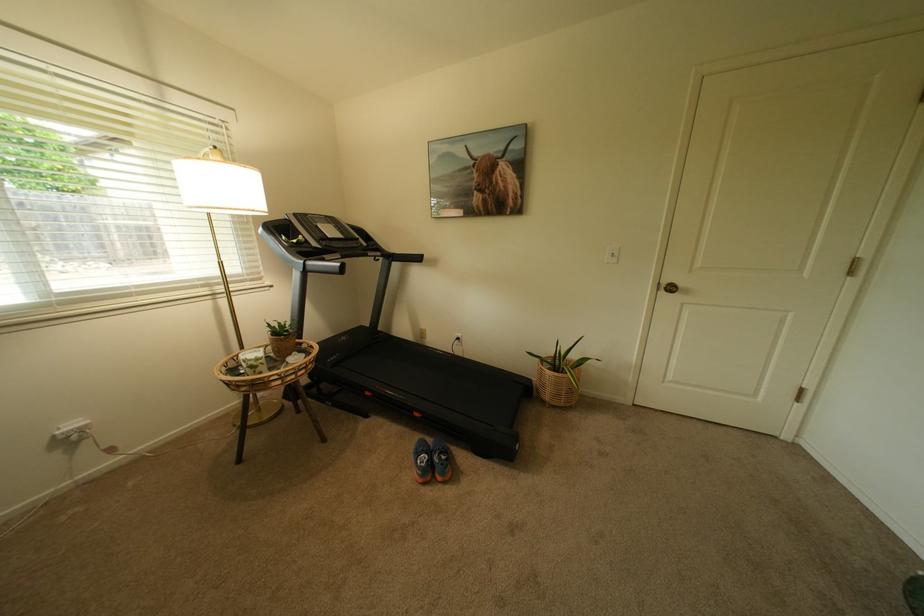
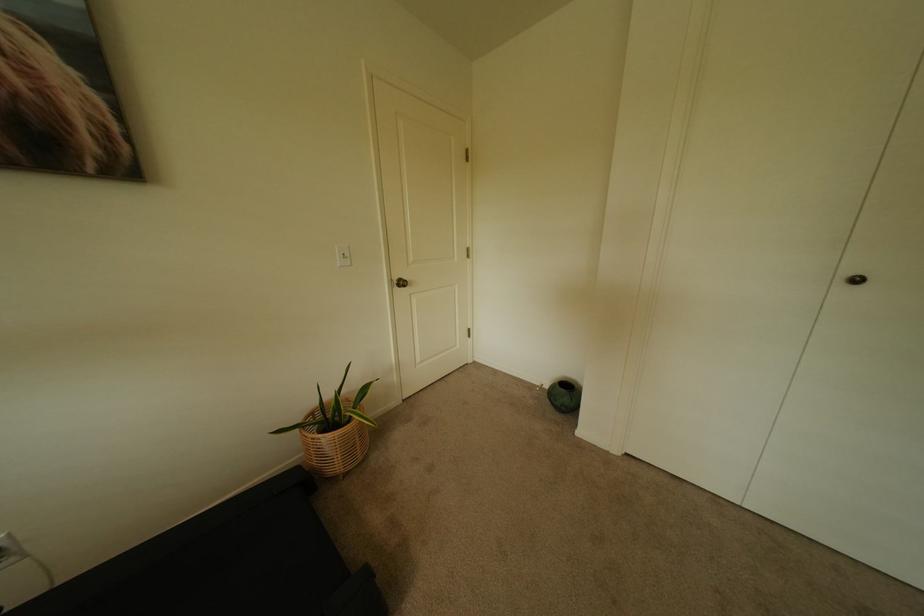
Question: How did the camera likely rotate?

Choices:
 (A) Left
 (B) Right
 (C) Up
 (D) Down

Answer: (B)